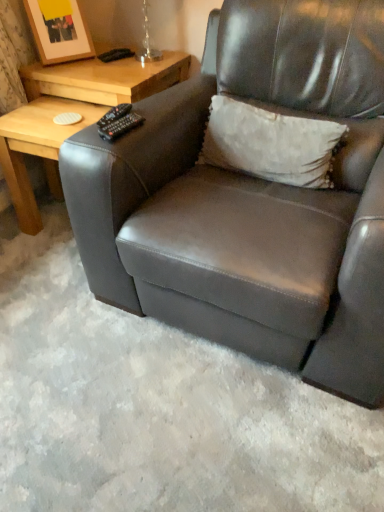
Find the location of a particular element. This screenshot has width=384, height=512. vacant space situated above light wood table at left, which is counted as the 1th table, starting from the bottom (from a real-world perspective) is located at coordinates (49, 115).